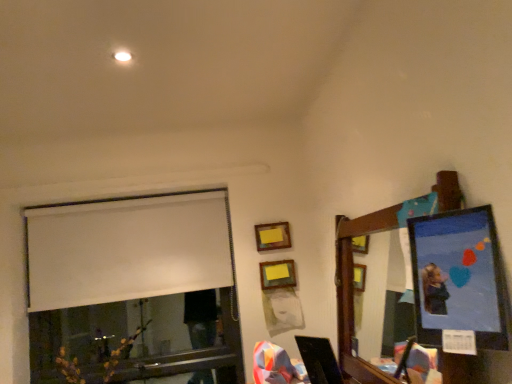
You are a GUI agent. You are given a task and a screenshot of the screen. Output one action in this format:
    pyautogui.click(x=<x>, y=<y>)
    Task: Click on the white matte window at upper left
    
    Given the screenshot: What is the action you would take?
    pyautogui.click(x=133, y=290)

How much space does matte plastic picture frame at upper right, which is the 1th picture frame in front-to-back order, occupy vertically?

matte plastic picture frame at upper right, which is the 1th picture frame in front-to-back order, is 17.71 inches in height.

What do you see at coordinates (352, 287) in the screenshot? Image resolution: width=512 pixels, height=384 pixels. I see `wooden mirror at upper right` at bounding box center [352, 287].

What is the approximate width of wooden picture frame at upper center, which is the 3th picture frame in right-to-left order?

The width of wooden picture frame at upper center, which is the 3th picture frame in right-to-left order, is 1.26 inches.

At what (x,y) coordinates should I click in order to perform the action: click on white matte window at upper left. Please return your answer as a coordinate pair (x, y). The height and width of the screenshot is (384, 512). Looking at the image, I should click on click(133, 290).

Based on the photo, from a real-world perspective, is wooden matte picture frame at upper center, the 2th picture frame positioned from the back, physically located above or below matte plastic picture frame at upper right, placed as the 1th picture frame when sorted from right to left?

Clearly, from a real-world perspective, wooden matte picture frame at upper center, the 2th picture frame positioned from the back, is below matte plastic picture frame at upper right, placed as the 1th picture frame when sorted from right to left.

Is matte plastic picture frame at upper right, which is the 1th picture frame in front-to-back order, at the back of wooden matte picture frame at upper center, the 2th picture frame positioned from the back?

No, matte plastic picture frame at upper right, which is the 1th picture frame in front-to-back order, is not at the back of wooden matte picture frame at upper center, the 2th picture frame positioned from the back.

Is wooden matte picture frame at upper center, which appears as the second picture frame when viewed from the right, not close to matte plastic picture frame at upper right, placed as the 1th picture frame when sorted from right to left?

Indeed, wooden matte picture frame at upper center, which appears as the second picture frame when viewed from the right, is not near matte plastic picture frame at upper right, placed as the 1th picture frame when sorted from right to left.

Can you confirm if matte plastic picture frame at upper right, the 3th picture frame viewed from the left, is shorter than white matte window at upper left?

Indeed, matte plastic picture frame at upper right, the 3th picture frame viewed from the left, has a lesser height compared to white matte window at upper left.

Is matte plastic picture frame at upper right, which is the 1th picture frame in front-to-back order, in front of or behind white matte window at upper left in the image?

matte plastic picture frame at upper right, which is the 1th picture frame in front-to-back order, is in front of white matte window at upper left.

From a real-world perspective, is matte plastic picture frame at upper right, which is the 1th picture frame in front-to-back order, physically located above or below white matte window at upper left?

matte plastic picture frame at upper right, which is the 1th picture frame in front-to-back order, is below white matte window at upper left.

Does point (435, 279) lie in front of point (197, 330)?

Yes, it is in front of point (197, 330).

Is wooden matte picture frame at upper center, the second picture frame viewed from the front, in contact with wooden mirror at upper right?

No, wooden matte picture frame at upper center, the second picture frame viewed from the front, is not touching wooden mirror at upper right.

From the image's perspective, would you say wooden matte picture frame at upper center, the second picture frame viewed from the front, is positioned over wooden mirror at upper right?

No, from the image's perspective, wooden matte picture frame at upper center, the second picture frame viewed from the front, is not above wooden mirror at upper right.

Is wooden matte picture frame at upper center, the 2th picture frame positioned from the back, closer to the viewer compared to wooden mirror at upper right?

No, it is behind wooden mirror at upper right.

What's the angular difference between matte plastic picture frame at upper right, the 3th picture frame viewed from the left, and wooden matte picture frame at upper center, the 2th picture frame positioned from the back,'s facing directions?

The angle between the facing direction of matte plastic picture frame at upper right, the 3th picture frame viewed from the left, and the facing direction of wooden matte picture frame at upper center, the 2th picture frame positioned from the back, is 90 degrees.

Is matte plastic picture frame at upper right, placed as the 1th picture frame when sorted from right to left, aimed at wooden matte picture frame at upper center, the 2th picture frame positioned from the back?

No, matte plastic picture frame at upper right, placed as the 1th picture frame when sorted from right to left, is not oriented towards wooden matte picture frame at upper center, the 2th picture frame positioned from the back.

In the image, is matte plastic picture frame at upper right, the third picture frame viewed from the back, positioned in front of or behind wooden matte picture frame at upper center, the second picture frame viewed from the front?

matte plastic picture frame at upper right, the third picture frame viewed from the back, is in front of wooden matte picture frame at upper center, the second picture frame viewed from the front.

Is wooden mirror at upper right to the right of white matte window at upper left from the viewer's perspective?

Yes.

Is wooden mirror at upper right shorter than white matte window at upper left?

Incorrect, the height of wooden mirror at upper right does not fall short of that of white matte window at upper left.

Is wooden mirror at upper right facing away from white matte window at upper left?

That's not correct — wooden mirror at upper right is not looking away from white matte window at upper left.

Can you confirm if wooden picture frame at upper center, acting as the 1th picture frame starting from the left, is wider than wooden matte picture frame at upper center, the 2th picture frame positioned from the left?

In fact, wooden picture frame at upper center, acting as the 1th picture frame starting from the left, might be narrower than wooden matte picture frame at upper center, the 2th picture frame positioned from the left.

Find the location of a particular element. The image size is (512, 384). picture frame located behind the wooden matte picture frame at upper center, which appears as the second picture frame when viewed from the right is located at coordinates (272, 236).

Which object is positioned more to the right, wooden picture frame at upper center, which is the 3th picture frame in right-to-left order, or wooden matte picture frame at upper center, which appears as the second picture frame when viewed from the right?

Positioned to the right is wooden matte picture frame at upper center, which appears as the second picture frame when viewed from the right.

From a real-world perspective, which object stands above the other?

From a 3D spatial view, wooden picture frame at upper center, the 1th picture frame when ordered from back to front, is above.

Is wooden matte picture frame at upper center, the 2th picture frame positioned from the back, bigger than wooden picture frame at upper center, which is the 3th picture frame in right-to-left order?

Indeed, wooden matte picture frame at upper center, the 2th picture frame positioned from the back, has a larger size compared to wooden picture frame at upper center, which is the 3th picture frame in right-to-left order.

Is wooden matte picture frame at upper center, the 2th picture frame positioned from the back, facing towards wooden picture frame at upper center, the 1th picture frame when ordered from back to front?

No.

From the image's perspective, is wooden matte picture frame at upper center, the second picture frame viewed from the front, over wooden picture frame at upper center, which is the 3th picture frame in right-to-left order?

No, from the image's perspective, wooden matte picture frame at upper center, the second picture frame viewed from the front, is not over wooden picture frame at upper center, which is the 3th picture frame in right-to-left order.

This screenshot has height=384, width=512. What are the coordinates of `the 2nd picture frame positioned below the matte plastic picture frame at upper right, placed as the 1th picture frame when sorted from right to left (from the image's perspective)` in the screenshot? It's located at (277, 274).

Locate an element on the screen. Image resolution: width=512 pixels, height=384 pixels. window above the matte plastic picture frame at upper right, placed as the 1th picture frame when sorted from right to left (from a real-world perspective) is located at coordinates (133, 290).

From the image, which object appears to be nearer to matte plastic picture frame at upper right, placed as the 1th picture frame when sorted from right to left, white matte window at upper left or wooden matte picture frame at upper center, the 2th picture frame positioned from the left?

wooden matte picture frame at upper center, the 2th picture frame positioned from the left, is positioned closer to the anchor matte plastic picture frame at upper right, placed as the 1th picture frame when sorted from right to left.

Looking at this image, when comparing their distances from wooden matte picture frame at upper center, the 2th picture frame positioned from the back, does wooden mirror at upper right or matte plastic picture frame at upper right, which is the 1th picture frame in front-to-back order, seem further?

matte plastic picture frame at upper right, which is the 1th picture frame in front-to-back order, is further to wooden matte picture frame at upper center, the 2th picture frame positioned from the back.

Estimate the real-world distances between objects in this image. Which object is further from wooden picture frame at upper center, the 1th picture frame when ordered from back to front, white matte window at upper left or matte plastic picture frame at upper right, placed as the 1th picture frame when sorted from right to left?

matte plastic picture frame at upper right, placed as the 1th picture frame when sorted from right to left, is further to wooden picture frame at upper center, the 1th picture frame when ordered from back to front.

Estimate the real-world distances between objects in this image. Which object is further from wooden matte picture frame at upper center, which appears as the second picture frame when viewed from the right, wooden picture frame at upper center, which is the 3th picture frame in right-to-left order, or white matte window at upper left?

Based on the image, white matte window at upper left appears to be further to wooden matte picture frame at upper center, which appears as the second picture frame when viewed from the right.

From the image, which object appears to be farther from white matte window at upper left, matte plastic picture frame at upper right, which is the 1th picture frame in front-to-back order, or wooden picture frame at upper center, acting as the 1th picture frame starting from the left?

matte plastic picture frame at upper right, which is the 1th picture frame in front-to-back order, is further to white matte window at upper left.

Looking at the image, which one is located closer to white matte window at upper left, wooden picture frame at upper center, positioned as the third picture frame in front-to-back order, or wooden mirror at upper right?

Based on the image, wooden picture frame at upper center, positioned as the third picture frame in front-to-back order, appears to be nearer to white matte window at upper left.

Which object lies further to the anchor point wooden mirror at upper right, wooden matte picture frame at upper center, the 2th picture frame positioned from the left, or matte plastic picture frame at upper right, placed as the 1th picture frame when sorted from right to left?

wooden matte picture frame at upper center, the 2th picture frame positioned from the left, lies further to wooden mirror at upper right than the other object.

Based on their spatial positions, is white matte window at upper left or wooden picture frame at upper center, the 1th picture frame when ordered from back to front, further from wooden mirror at upper right?

white matte window at upper left.

Locate an element on the screen. picture frame between white matte window at upper left and wooden matte picture frame at upper center, the 2th picture frame positioned from the left, from left to right is located at coordinates (272, 236).

You are a GUI agent. You are given a task and a screenshot of the screen. Output one action in this format:
    pyautogui.click(x=<x>, y=<y>)
    Task: Click on the picture frame between matte plastic picture frame at upper right, the 3th picture frame viewed from the left, and wooden picture frame at upper center, positioned as the third picture frame in front-to-back order, along the z-axis
    Image resolution: width=512 pixels, height=384 pixels.
    Given the screenshot: What is the action you would take?
    pyautogui.click(x=277, y=274)

The width and height of the screenshot is (512, 384). What are the coordinates of `window located between matte plastic picture frame at upper right, the 3th picture frame viewed from the left, and wooden matte picture frame at upper center, the 2th picture frame positioned from the back, in the depth direction` in the screenshot? It's located at (133, 290).

Where is `window located between matte plastic picture frame at upper right, the third picture frame viewed from the back, and wooden picture frame at upper center, acting as the 1th picture frame starting from the left, in the depth direction`? This screenshot has height=384, width=512. window located between matte plastic picture frame at upper right, the third picture frame viewed from the back, and wooden picture frame at upper center, acting as the 1th picture frame starting from the left, in the depth direction is located at coordinates (133, 290).